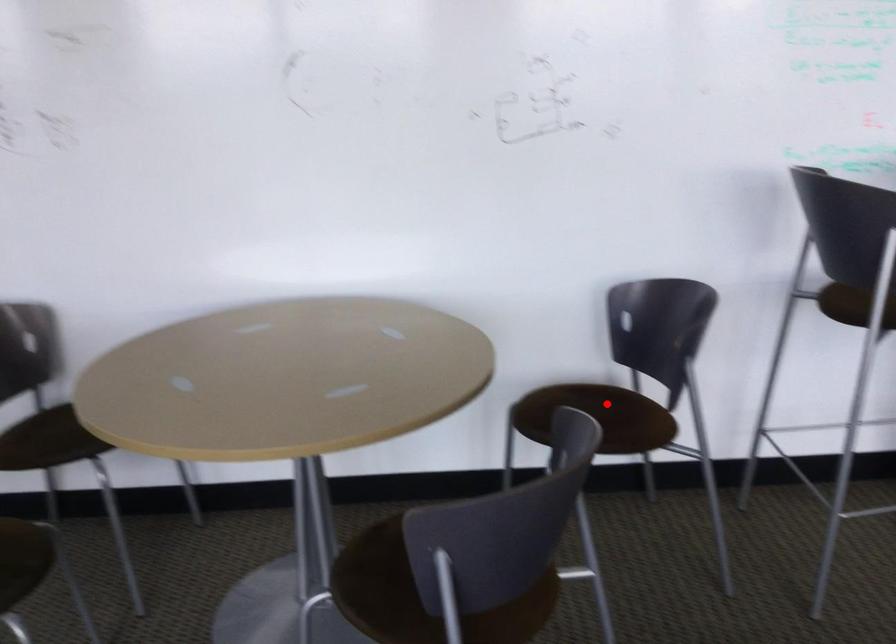
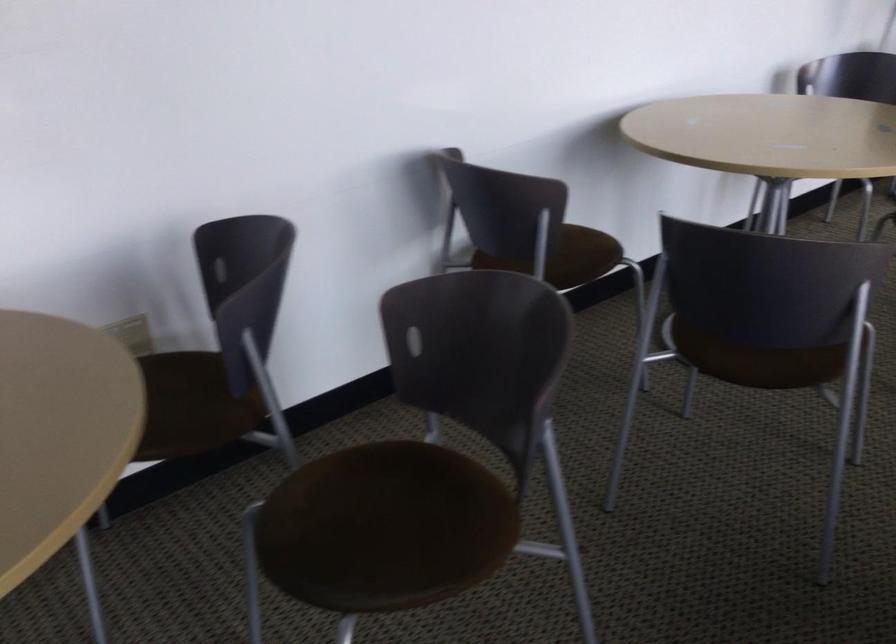
Question: I am providing you with two images of the same scene from different viewpoints. A red point is marked on the first image. At the location where the point appears in image 1, is it still visible in image 2?

Choices:
 (A) Yes
 (B) No

Answer: (B)